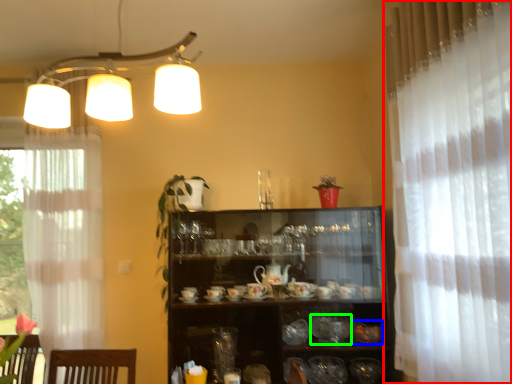
Question: Based on their relative distances, which object is nearer to curtain (highlighted by a red box)? Choose from tableware (highlighted by a blue box) and tableware (highlighted by a green box).

Choices:
 (A) tableware
 (B) tableware

Answer: (A)